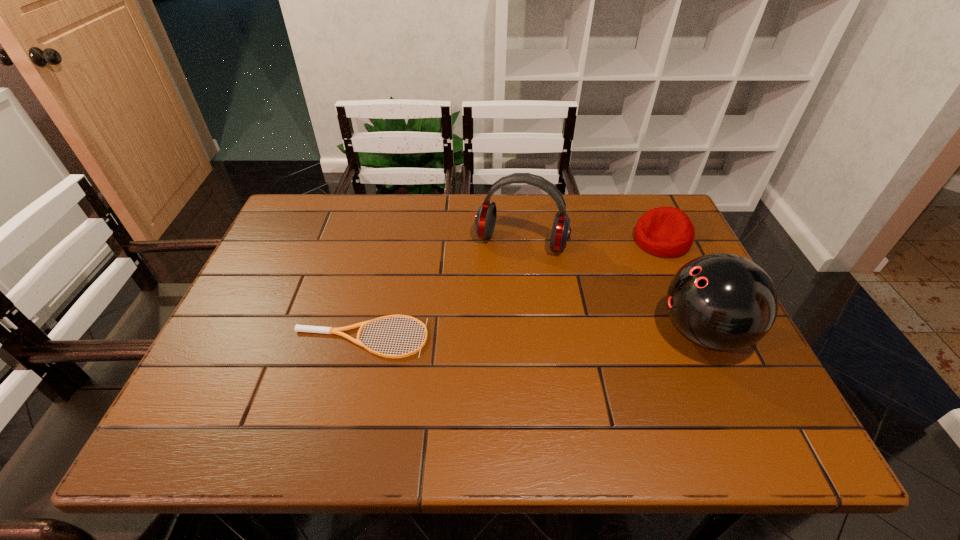
I want to click on object that is at the far right corner, so click(668, 232).

In order to click on object located at the near right corner in this screenshot , I will do `click(721, 302)`.

Find the location of a particular element. The width and height of the screenshot is (960, 540). vacant position at the far edge of the desktop is located at coordinates (427, 194).

In the image, there is a desktop. Where is `free space at the near edge`? This screenshot has width=960, height=540. free space at the near edge is located at coordinates (667, 368).

The height and width of the screenshot is (540, 960). In order to click on blank space at the left edge of the desktop in this screenshot , I will do `click(295, 248)`.

The width and height of the screenshot is (960, 540). What are the coordinates of `free region at the far left corner of the desktop` in the screenshot? It's located at (338, 206).

Locate an element on the screen. This screenshot has width=960, height=540. vacant area at the far right corner of the desktop is located at coordinates (634, 214).

Find the location of a particular element. Image resolution: width=960 pixels, height=540 pixels. vacant space that's between the bowling ball and the second object from left to right is located at coordinates (612, 288).

I want to click on empty space between the leftmost object and the earphone, so click(441, 290).

The width and height of the screenshot is (960, 540). I want to click on free space between the earphone and the third tallest object, so click(591, 241).